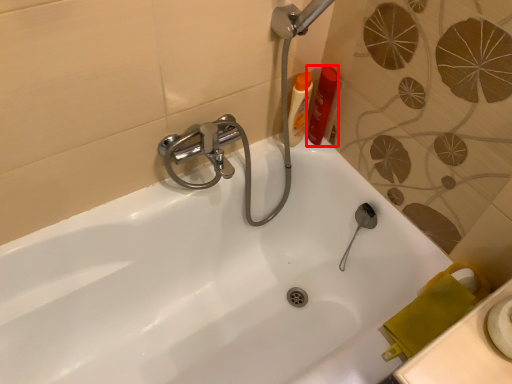
Question: From the image's perspective, considering the relative positions of toiletry (annotated by the red box) and toiletry in the image provided, where is toiletry (annotated by the red box) located with respect to the staircase?

Choices:
 (A) above
 (B) below

Answer: (A)